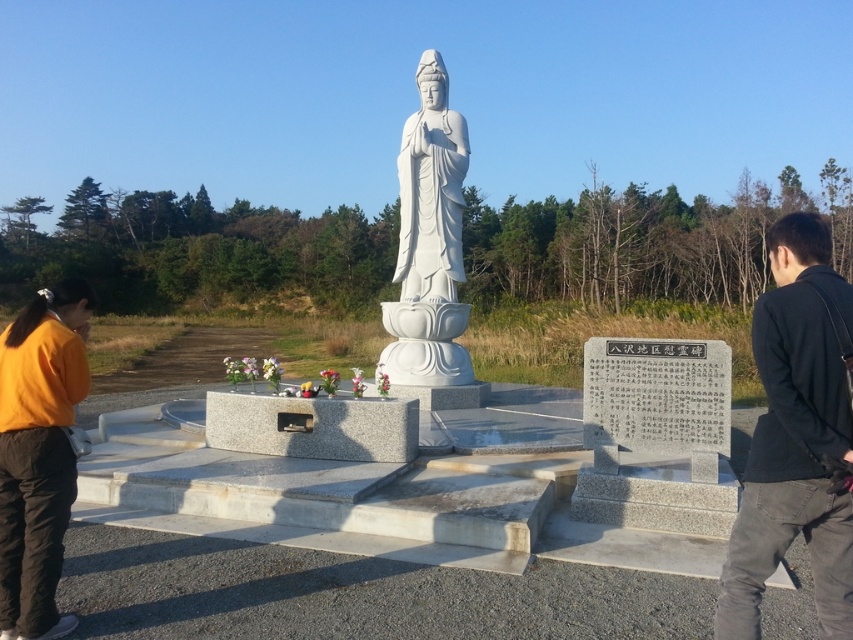
Can you confirm if black cotton jacket at right is taller than white marble statue at center?

No, black cotton jacket at right is not taller than white marble statue at center.

Who is positioned more to the right, black cotton jacket at right or white marble statue at center?

black cotton jacket at right

Who is more forward, (801, 435) or (399, 244)?

Point (801, 435) is in front.

Where is `black cotton jacket at right`? This screenshot has height=640, width=853. black cotton jacket at right is located at coordinates (796, 436).

Based on the photo, does orange fabric at lower left appear on the right side of white marble statue at center?

In fact, orange fabric at lower left is to the left of white marble statue at center.

Is orange fabric at lower left below white marble statue at center?

Indeed, orange fabric at lower left is positioned under white marble statue at center.

Between point (1, 532) and point (440, 273), which one is positioned in front?

Positioned in front is point (1, 532).

You are a GUI agent. You are given a task and a screenshot of the screen. Output one action in this format:
    pyautogui.click(x=<x>, y=<y>)
    Task: Click on the orange fabric at lower left
    The height and width of the screenshot is (640, 853).
    Given the screenshot: What is the action you would take?
    (38, 452)

Is black cotton jacket at right thinner than orange fabric at lower left?

No.

Between black cotton jacket at right and orange fabric at lower left, which one has more height?

Standing taller between the two is black cotton jacket at right.

Image resolution: width=853 pixels, height=640 pixels. Describe the element at coordinates (796, 436) in the screenshot. I see `black cotton jacket at right` at that location.

This screenshot has height=640, width=853. Identify the location of black cotton jacket at right. [x=796, y=436].